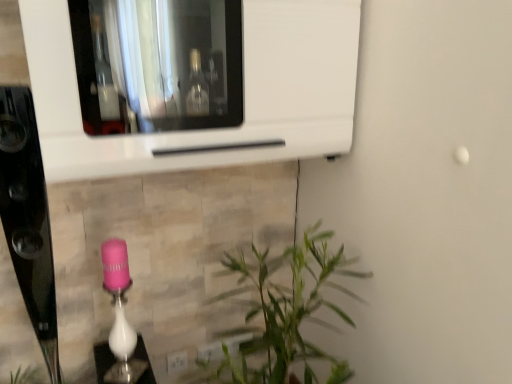
Based on the photo, what is the approximate width of white glossy microwave at upper center?

14.14 inches.

The height and width of the screenshot is (384, 512). What do you see at coordinates (177, 361) in the screenshot? I see `white plastic electric outlet at lower center` at bounding box center [177, 361].

Locate an element on the screen. This screenshot has width=512, height=384. pink glossy lamp at lower center is located at coordinates (120, 315).

Is white glossy microwave at upper center situated inside white plastic electric outlet at lower center or outside?

white glossy microwave at upper center exists outside the volume of white plastic electric outlet at lower center.

Which is nearer, (329, 43) or (175, 368)?

Point (329, 43).

Is the depth of white glossy microwave at upper center less than that of white plastic electric outlet at lower center?

Yes, it is.

In the scene shown: Considering the relative sizes of white glossy microwave at upper center and white plastic electric outlet at lower center in the image provided, is white glossy microwave at upper center thinner than white plastic electric outlet at lower center?

No.

Considering the sizes of pink glossy lamp at lower center and white plastic electric outlet at lower center in the image, is pink glossy lamp at lower center wider or thinner than white plastic electric outlet at lower center?

In the image, pink glossy lamp at lower center appears to be wider than white plastic electric outlet at lower center.

From a real-world perspective, who is located higher, pink glossy lamp at lower center or white plastic electric outlet at lower center?

In real-world perspective, pink glossy lamp at lower center is above.

Is pink glossy lamp at lower center turned away from white plastic electric outlet at lower center?

No, white plastic electric outlet at lower center is not at the back of pink glossy lamp at lower center.

Is pink glossy lamp at lower center with white plastic electric outlet at lower center?

They are not placed beside each other.

Between white plastic electric outlet at lower center and pink glossy lamp at lower center, which one appears on the right side from the viewer's perspective?

white plastic electric outlet at lower center.

Which object is closer to the camera, white plastic electric outlet at lower center or pink glossy lamp at lower center?

pink glossy lamp at lower center is in front.

How far apart are white plastic electric outlet at lower center and pink glossy lamp at lower center?

white plastic electric outlet at lower center and pink glossy lamp at lower center are 13.56 inches apart.

Based on their sizes in the image, would you say white plastic electric outlet at lower center is bigger or smaller than pink glossy lamp at lower center?

white plastic electric outlet at lower center is smaller than pink glossy lamp at lower center.

Which of these two, pink glossy lamp at lower center or white glossy microwave at upper center, stands taller?

With more height is white glossy microwave at upper center.

Considering the relative positions of pink glossy lamp at lower center and white glossy microwave at upper center in the image provided, is pink glossy lamp at lower center to the left or to the right of white glossy microwave at upper center?

Clearly, pink glossy lamp at lower center is on the left of white glossy microwave at upper center in the image.

Which point is more distant from viewer, [113,371] or [40,95]?

Positioned behind is point [113,371].

Do you think pink glossy lamp at lower center is within white glossy microwave at upper center, or outside of it?

pink glossy lamp at lower center is spatially situated outside white glossy microwave at upper center.

Is white glossy microwave at upper center placed right next to pink glossy lamp at lower center?

No, white glossy microwave at upper center is not with pink glossy lamp at lower center.

Considering the relative sizes of white glossy microwave at upper center and pink glossy lamp at lower center in the image provided, is white glossy microwave at upper center bigger than pink glossy lamp at lower center?

Correct, white glossy microwave at upper center is larger in size than pink glossy lamp at lower center.

Between white glossy microwave at upper center and pink glossy lamp at lower center, which one appears on the right side from the viewer's perspective?

Positioned to the right is white glossy microwave at upper center.

Looking at their sizes, would you say white glossy microwave at upper center is wider or thinner than pink glossy lamp at lower center?

Clearly, white glossy microwave at upper center has more width compared to pink glossy lamp at lower center.

From the picture: From the image's perspective, is white plastic electric outlet at lower center on top of white glossy microwave at upper center?

No, from the image's perspective, white plastic electric outlet at lower center is not on top of white glossy microwave at upper center.

How many degrees apart are the facing directions of white plastic electric outlet at lower center and white glossy microwave at upper center?

They differ by 0.563 degrees in their facing directions.

Is white plastic electric outlet at lower center to the left of white glossy microwave at upper center from the viewer's perspective?

Yes, white plastic electric outlet at lower center is to the left of white glossy microwave at upper center.

Could you measure the distance between white plastic electric outlet at lower center and white glossy microwave at upper center?

The distance of white plastic electric outlet at lower center from white glossy microwave at upper center is 1.03 meters.

Identify the location of electric outlet located below the white glossy microwave at upper center (from the image's perspective). (177, 361).

Identify the location of electric outlet that is behind the pink glossy lamp at lower center. The height and width of the screenshot is (384, 512). click(177, 361).

When comparing their distances from white glossy microwave at upper center, does pink glossy lamp at lower center or white plastic electric outlet at lower center seem closer?

pink glossy lamp at lower center is positioned closer to the anchor white glossy microwave at upper center.

From the image, which object appears to be nearer to pink glossy lamp at lower center, white glossy microwave at upper center or white plastic electric outlet at lower center?

Based on the image, white plastic electric outlet at lower center appears to be nearer to pink glossy lamp at lower center.

Consider the image. From the image, which object appears to be nearer to pink glossy lamp at lower center, white plastic electric outlet at lower center or white glossy microwave at upper center?

white plastic electric outlet at lower center is closer to pink glossy lamp at lower center.

When comparing their distances from white plastic electric outlet at lower center, does pink glossy lamp at lower center or white glossy microwave at upper center seem closer?

Based on the image, pink glossy lamp at lower center appears to be nearer to white plastic electric outlet at lower center.

Based on their spatial positions, is white glossy microwave at upper center or pink glossy lamp at lower center closer to white plastic electric outlet at lower center?

pink glossy lamp at lower center.

Looking at the image, which one is located further to white glossy microwave at upper center, white plastic electric outlet at lower center or pink glossy lamp at lower center?

white plastic electric outlet at lower center.

Identify the location of lamp that lies between white glossy microwave at upper center and white plastic electric outlet at lower center from top to bottom. The width and height of the screenshot is (512, 384). pyautogui.click(x=120, y=315).